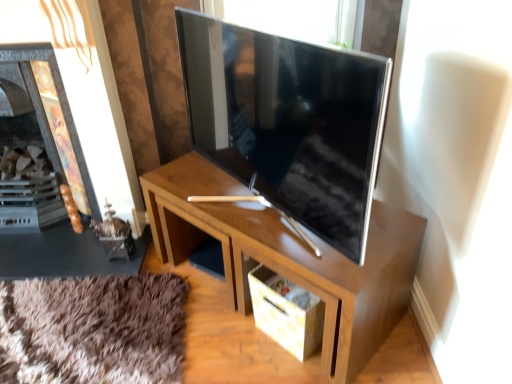
What do you see at coordinates (54, 118) in the screenshot?
I see `wooden fireplace at left` at bounding box center [54, 118].

What is the approximate width of wooden desk at center?

45.89 centimeters.

Locate an element on the screen. This screenshot has width=512, height=384. satin silver tv at center is located at coordinates (289, 121).

In the scene shown: Is wooden fireplace at left positioned far away from matte cardboard drawer at lower center?

Yes.

Which object is positioned more to the left, wooden fireplace at left or matte cardboard drawer at lower center?

From the viewer's perspective, wooden fireplace at left appears more on the left side.

Between wooden fireplace at left and matte cardboard drawer at lower center, which one has larger size?

wooden fireplace at left.

Could you tell me if wooden fireplace at left is turned towards matte cardboard drawer at lower center?

No, wooden fireplace at left is not facing towards matte cardboard drawer at lower center.

From a real-world perspective, relative to matte cardboard drawer at lower center, is satin silver tv at center vertically above or below?

satin silver tv at center is situated higher than matte cardboard drawer at lower center in the real world.

Which object is more forward, satin silver tv at center or matte cardboard drawer at lower center?

satin silver tv at center is closer to the camera.

Is satin silver tv at center directly adjacent to matte cardboard drawer at lower center?

satin silver tv at center and matte cardboard drawer at lower center are not in contact.

Between satin silver tv at center and wooden fireplace at left, which one appears on the right side from the viewer's perspective?

Positioned to the right is satin silver tv at center.

Which is correct: satin silver tv at center is inside wooden fireplace at left, or outside of it?

satin silver tv at center is not inside wooden fireplace at left, it's outside.

Looking at this image, is satin silver tv at center not near wooden fireplace at left?

That's not correct — satin silver tv at center is a little close to wooden fireplace at left.

Which object is closer to the camera taking this photo, wooden fireplace at left or wooden desk at center?

Positioned in front is wooden desk at center.

In the scene shown: From the image's perspective, would you say wooden fireplace at left is shown under wooden desk at center?

Actually, wooden fireplace at left appears above wooden desk at center in the image.

Find the location of a particular element. desk below the wooden fireplace at left (from the image's perspective) is located at coordinates (291, 257).

Is point (72, 147) positioned behind point (296, 265)?

Yes, it is.

Considering the positions of points (330, 336) and (368, 264), is point (330, 336) closer to camera compared to point (368, 264)?

No, it is not.

From a real-world perspective, is matte cardboard drawer at lower center physically below wooden desk at center?

Yes, from a real-world perspective, matte cardboard drawer at lower center is beneath wooden desk at center.

Does matte cardboard drawer at lower center have a greater width compared to wooden desk at center?

In fact, matte cardboard drawer at lower center might be narrower than wooden desk at center.

Between wooden fireplace at left and satin silver tv at center, which one has larger size?

satin silver tv at center is bigger.

From a real-world perspective, is wooden fireplace at left below satin silver tv at center?

Correct, in the physical world, wooden fireplace at left is lower than satin silver tv at center.

From the image's perspective, does wooden fireplace at left appear higher than satin silver tv at center?

Yes.

Find the location of a particular element. television lying in front of the wooden fireplace at left is located at coordinates (289, 121).

At what (x,y) coordinates should I click in order to perform the action: click on desk lying in front of the matte cardboard drawer at lower center. Please return your answer as a coordinate pair (x, y). Looking at the image, I should click on (291, 257).

From the image's perspective, is wooden desk at center located beneath matte cardboard drawer at lower center?

No, from the image's perspective, wooden desk at center is not beneath matte cardboard drawer at lower center.

Is the surface of wooden desk at center in direct contact with matte cardboard drawer at lower center?

No, wooden desk at center is not beside matte cardboard drawer at lower center.

How much distance is there between wooden desk at center and matte cardboard drawer at lower center?

wooden desk at center is 6.55 inches away from matte cardboard drawer at lower center.

What are the coordinates of `fireplace behind the matte cardboard drawer at lower center` in the screenshot? It's located at (54, 118).

Find the location of a particular element. drawer below the satin silver tv at center (from a real-world perspective) is located at coordinates (298, 284).

Looking at the image, which one is located further to matte cardboard drawer at lower center, satin silver tv at center or wooden fireplace at left?

wooden fireplace at left is positioned further to the anchor matte cardboard drawer at lower center.

Considering their positions, is wooden desk at center positioned closer to wooden fireplace at left than satin silver tv at center?

satin silver tv at center.

Which object lies nearer to the anchor point wooden fireplace at left, wooden desk at center or matte cardboard drawer at lower center?

The object closer to wooden fireplace at left is wooden desk at center.

Estimate the real-world distances between objects in this image. Which object is closer to wooden fireplace at left, satin silver tv at center or wooden desk at center?

Among the two, satin silver tv at center is located nearer to wooden fireplace at left.

Considering their positions, is matte cardboard drawer at lower center positioned closer to satin silver tv at center than wooden fireplace at left?

matte cardboard drawer at lower center lies closer to satin silver tv at center than the other object.

Looking at the image, which one is located closer to matte cardboard drawer at lower center, wooden desk at center or wooden fireplace at left?

wooden desk at center is positioned closer to the anchor matte cardboard drawer at lower center.

Based on their spatial positions, is wooden fireplace at left or wooden desk at center closer to satin silver tv at center?

wooden desk at center.

Which object lies nearer to the anchor point satin silver tv at center, wooden fireplace at left or matte cardboard drawer at lower center?

matte cardboard drawer at lower center lies closer to satin silver tv at center than the other object.

Where is `desk between satin silver tv at center and matte cardboard drawer at lower center in the up-down direction`? Image resolution: width=512 pixels, height=384 pixels. desk between satin silver tv at center and matte cardboard drawer at lower center in the up-down direction is located at coordinates (291, 257).

Find the location of a particular element. desk between wooden fireplace at left and matte cardboard drawer at lower center in the horizontal direction is located at coordinates (291, 257).

Where is `television situated between wooden fireplace at left and wooden desk at center from left to right`? television situated between wooden fireplace at left and wooden desk at center from left to right is located at coordinates (289, 121).

I want to click on television between wooden fireplace at left and matte cardboard drawer at lower center in the horizontal direction, so click(x=289, y=121).